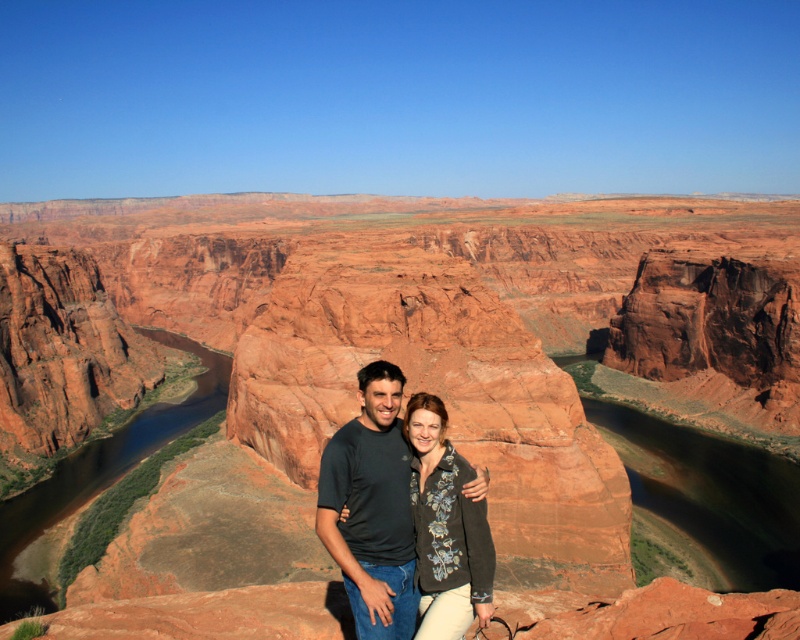
Question: Considering the real-world distances, which object is farthest from the dark gray textured sweater at center?

Choices:
 (A) brown smooth water at center
 (B) reddish-brown rock formation at center
 (C) matte black shirt at center

Answer: (B)

Question: Can you confirm if reddish-brown rock formation at center is positioned to the right of dark gray textured sweater at center?

Choices:
 (A) yes
 (B) no

Answer: (B)

Question: Is brown smooth river at center closer to the viewer compared to dark gray textured sweater at center?

Choices:
 (A) yes
 (B) no

Answer: (B)

Question: Among these objects, which one is nearest to the camera?

Choices:
 (A) brown smooth water at center
 (B) reddish-brown rock formation at center
 (C) dark gray textured sweater at center

Answer: (C)

Question: Is matte black shirt at center further to camera compared to dark gray textured sweater at center?

Choices:
 (A) yes
 (B) no

Answer: (B)

Question: Which point is closer to the camera?

Choices:
 (A) (430, 428)
 (B) (170, 412)

Answer: (A)